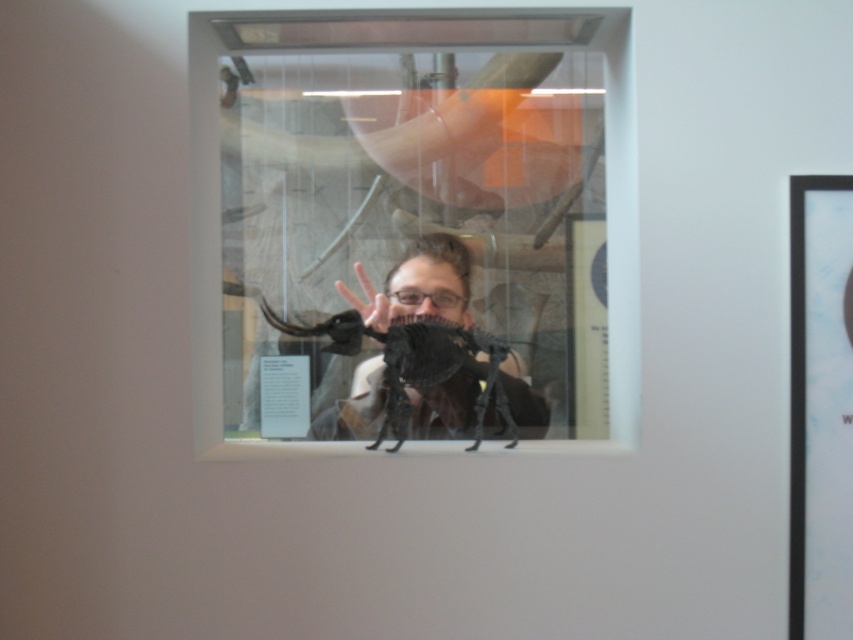
You are a museum security guard checking the display case. You notice the black matte spider at center and the matte black hand at center inside the case. Which object is taller?

The black matte spider at center is taller than the matte black hand at center.

You are a security guard in a museum and need to locate the black matte mirror at center. According to the coordinates provided, where should you look to find it?

The black matte mirror at center is located at the coordinates point (418, 236).